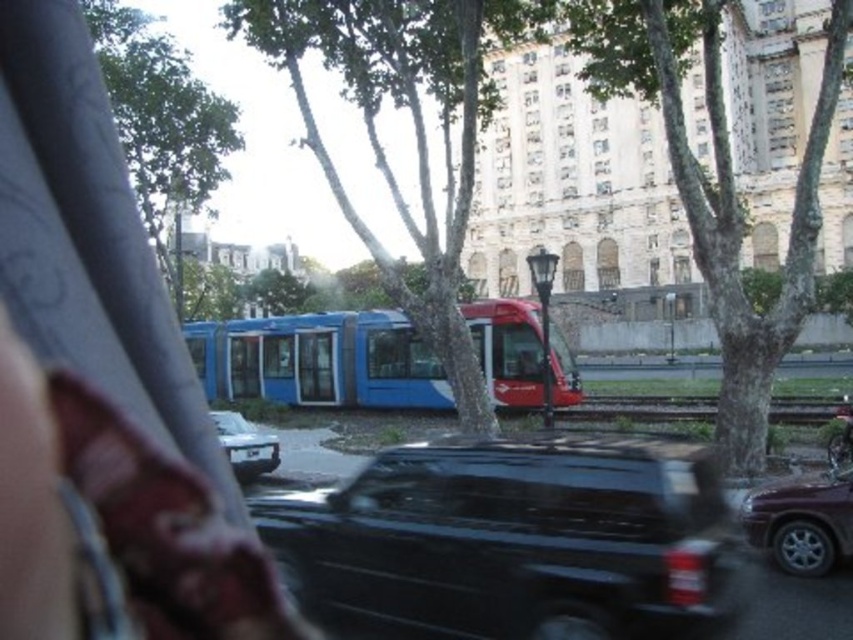
You are a delivery driver needing to park your 12.5 feet long truck between the shiny black suv at center and the shiny maroon suv at lower right. Can you fit your truck there?

The shiny black suv at center is 39.18 feet from the shiny maroon suv at lower right. Since your truck is 12.5 feet long, there is enough space between them to park your truck.

You are a pedestrian standing at the intersection and see the shiny maroon suv at lower right and the white glossy car at center. Which one is closer to the bottom edge of the image?

The shiny maroon suv at lower right is closer to the bottom edge of the image because it is positioned below the white glossy car at center.

You are a pedestrian standing at the crosswalk and want to cross the street safely. You see the blue matte bus at center and the shiny maroon suv at lower right. Which vehicle is closer to you?

The shiny maroon suv at lower right is closer to you because it is positioned lower in the image, which typically indicates it is nearer to the viewer compared to the blue matte bus at center that is higher up.